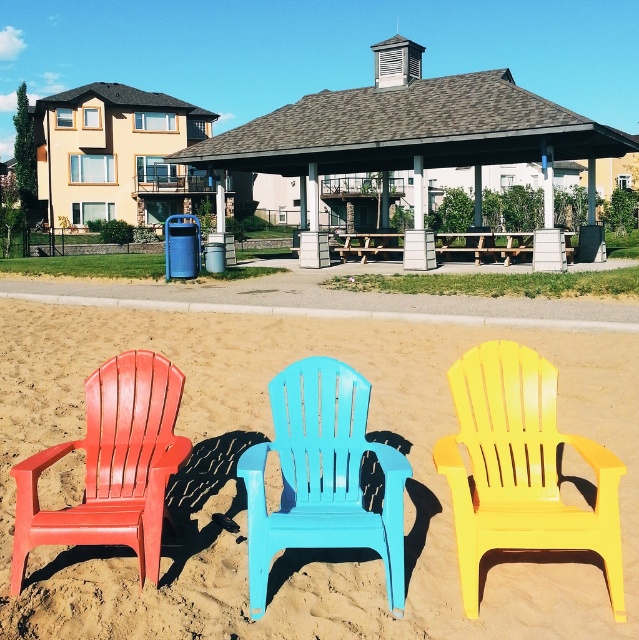
Based on the photo, you are standing at the origin point of the scene. Which object is located at the coordinates point (520, 468)?

The yellow plastic beach chair at center is located at point (520, 468).

You are standing in front of the yellow plastic beach chair at center and the light blue plastic chair at center. Which chair is closer to you?

The yellow plastic beach chair at center is closer to you because it is positioned further to the viewer than the light blue plastic chair at center.